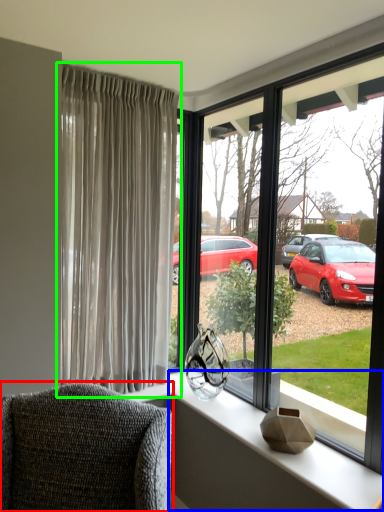
Question: Estimate the real-world distances between objects in this image. Which object is farther from chair (highlighted by a red box), window sill (highlighted by a blue box) or curtain (highlighted by a green box)?

Choices:
 (A) window sill
 (B) curtain

Answer: (B)